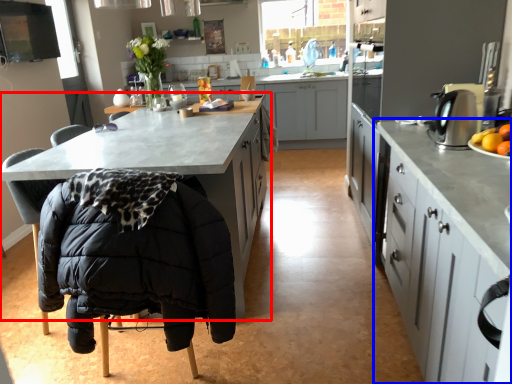
Question: Which object is further to the camera taking this photo, cabinetry (highlighted by a red box) or cabinetry (highlighted by a blue box)?

Choices:
 (A) cabinetry
 (B) cabinetry

Answer: (A)